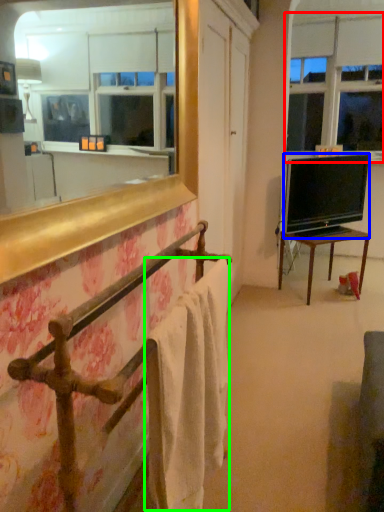
Question: Which object is positioned farthest from window screen (highlighted by a red box)? Select from television (highlighted by a blue box) and bath towel (highlighted by a green box).

Choices:
 (A) television
 (B) bath towel

Answer: (B)